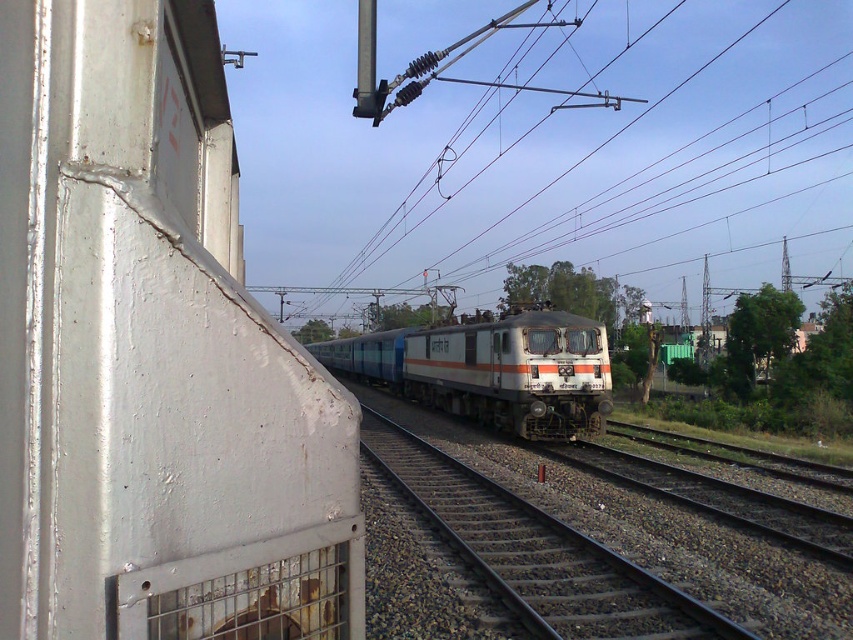
Does metallic wire at upper center come in front of silver metallic train at center?

That is False.

Between metallic wire at upper center and silver metallic train at center, which one has more height?

metallic wire at upper center is taller.

Where is `metallic wire at upper center`? This screenshot has height=640, width=853. metallic wire at upper center is located at coordinates (630, 160).

Image resolution: width=853 pixels, height=640 pixels. In order to click on metallic wire at upper center in this screenshot , I will do `click(630, 160)`.